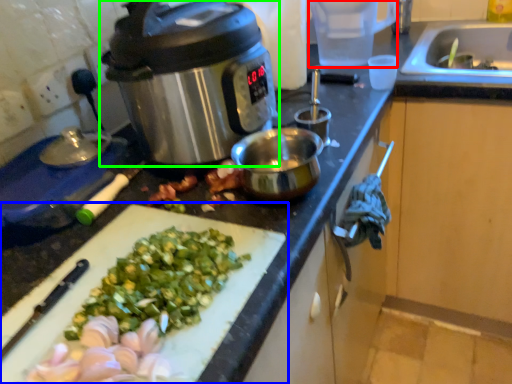
Question: Considering the real-world distances, which object is farthest from appliance (highlighted by a red box)? cutting board (highlighted by a blue box) or slow cooker (highlighted by a green box)?

Choices:
 (A) cutting board
 (B) slow cooker

Answer: (A)